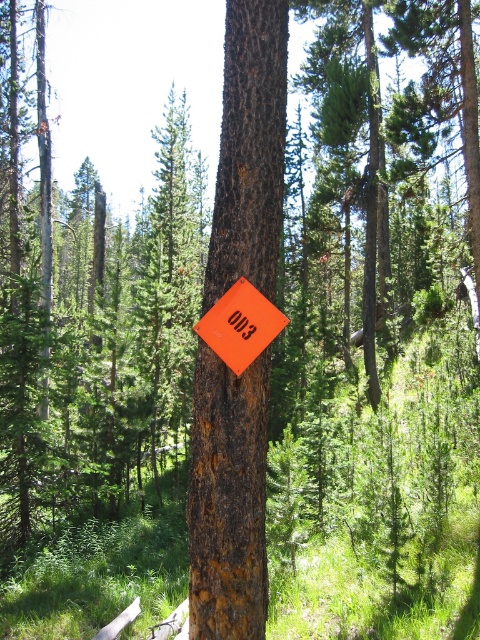
You are a hiker who wants to read the orange matte sign at center clearly. The rusty bark tree trunk at center is blocking your view. Can you move the tree trunk to get a better look at the sign?

The rusty bark tree trunk at center is positioned over orange matte sign at center, so moving the tree trunk would allow you to see the sign clearly. However, since the tree trunk is part of the tree, you cannot move it. You might need to find another angle or clear the obstruction around it.

You are a hiker with a 2.5 meter long ladder. You need to reach a high branch on the rusty bark tree trunk at center. Can your ladder reach the branch if you place it at the base of the tree?

The rusty bark tree trunk at center is 3.03 meters from camera. Since the ladder is 2.5 meters long, it may not be long enough to reach the branch unless the branch is within 2.5 meters from the base.